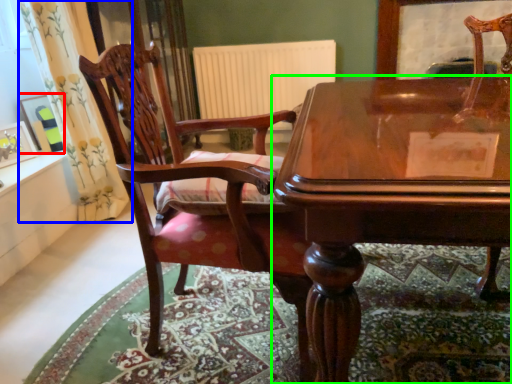
Question: Which is farther away from picture frame (highlighted by a red box)? curtain (highlighted by a blue box) or table (highlighted by a green box)?

Choices:
 (A) curtain
 (B) table

Answer: (B)